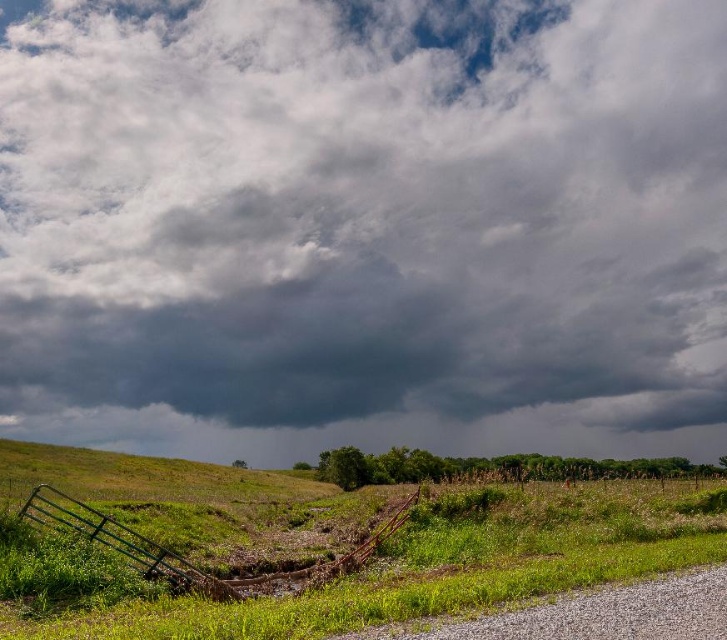
You are a drone operator flying a drone that has a maximum flight range of 150 feet. You want to fly the drone to the dark gray cloud at upper center. Can you reach it?

The distance between the dark gray cloud at upper center and the camera is 141.85 feet, which is within the drone operator drone maximum flight range of 150 feet. So yes, the drone can reach the dark gray cloud at upper center.

You are a hiker trying to navigate through the green grassy field at lower left and avoid the dark gray cloud at upper center. Which direction should you move to get away from the cloud?

The dark gray cloud at upper center is to the right of the green grassy field at lower left. To move away from the cloud, you should head towards the left direction.